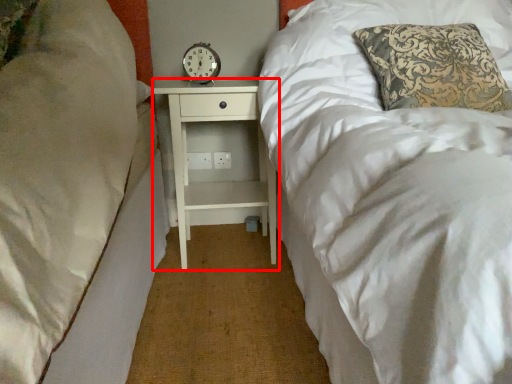
Question: From the image's perspective, where is nightstand (annotated by the red box) located in relation to clock in the image?

Choices:
 (A) below
 (B) above

Answer: (A)